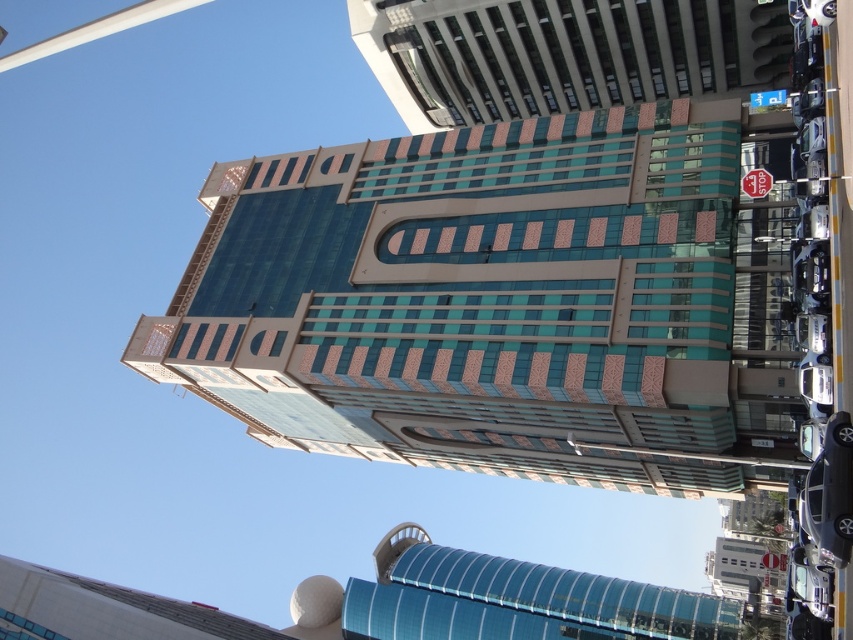
What do you see at coordinates (492, 304) in the screenshot? I see `teal glass building at center` at bounding box center [492, 304].

Does point (718, 308) lie behind point (747, 173)?

That is False.

You are a GUI agent. You are given a task and a screenshot of the screen. Output one action in this format:
    pyautogui.click(x=<x>, y=<y>)
    Task: Click on the teal glass building at center
    
    Given the screenshot: What is the action you would take?
    pyautogui.click(x=492, y=304)